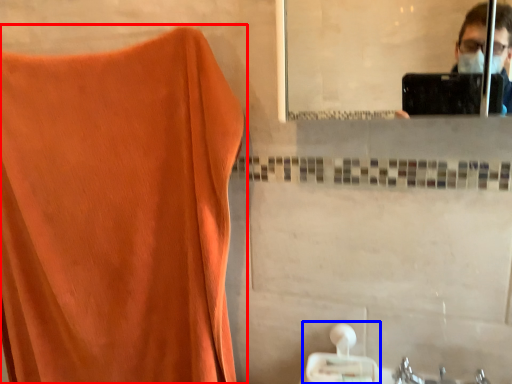
Question: Which point is further to the camera, curtain (highlighted by a red box) or tissue (highlighted by a blue box)?

Choices:
 (A) curtain
 (B) tissue

Answer: (B)